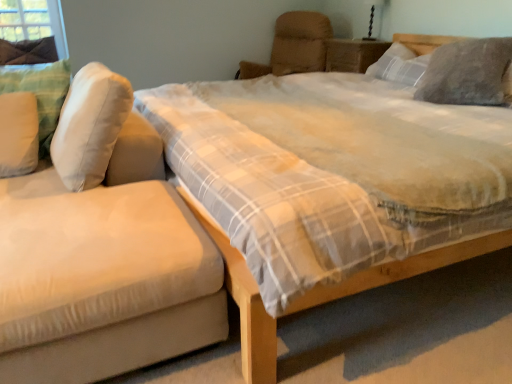
The height and width of the screenshot is (384, 512). Describe the element at coordinates (33, 22) in the screenshot. I see `green fabric at upper left` at that location.

In order to face beige fabric armchair at upper center, should I rotate leftwards or rightwards?

It's best to rotate right around 3.256 degrees.

Image resolution: width=512 pixels, height=384 pixels. What do you see at coordinates (243, 304) in the screenshot? I see `velvet beige bed at center` at bounding box center [243, 304].

Locate an element on the screen. The image size is (512, 384). suede-like beige studio couch at left is located at coordinates (97, 244).

Measure the distance from green fabric at upper left to gray fuzzy pillow at upper right, the 4th pillow from the left.

A distance of 9.87 feet exists between green fabric at upper left and gray fuzzy pillow at upper right, the 4th pillow from the left.

From the image's perspective, is green fabric at upper left located beneath gray fuzzy pillow at upper right, the 1th pillow positioned from the right?

No, from the image's perspective, green fabric at upper left is not below gray fuzzy pillow at upper right, the 1th pillow positioned from the right.

Identify the location of the 2nd pillow in front of the green fabric at upper left, counting from the anchor's position. Image resolution: width=512 pixels, height=384 pixels. (466, 72).

Can you confirm if green fabric at upper left is wider than gray fuzzy pillow at upper right, the 1th pillow positioned from the right?

In fact, green fabric at upper left might be narrower than gray fuzzy pillow at upper right, the 1th pillow positioned from the right.

Considering the positions of objects gray fuzzy pillow at upper right, the 4th pillow from the left, and velvet beige bed at center in the image provided, who is more to the right, gray fuzzy pillow at upper right, the 4th pillow from the left, or velvet beige bed at center?

gray fuzzy pillow at upper right, the 4th pillow from the left, is more to the right.

Can you confirm if gray fuzzy pillow at upper right, the 4th pillow from the left, is smaller than velvet beige bed at center?

Correct, gray fuzzy pillow at upper right, the 4th pillow from the left, occupies less space than velvet beige bed at center.

From the image's perspective, is gray fuzzy pillow at upper right, the 4th pillow from the left, above velvet beige bed at center?

Yes, from the image's perspective, gray fuzzy pillow at upper right, the 4th pillow from the left, is over velvet beige bed at center.

Considering the relative sizes of gray fuzzy pillow at upper right, the 1th pillow positioned from the right, and velvet beige bed at center in the image provided, is gray fuzzy pillow at upper right, the 1th pillow positioned from the right, wider than velvet beige bed at center?

No.

Would you say beige fabric armchair at upper center is inside or outside white soft pillow at left, which is counted as the 4th pillow, starting from the right?

beige fabric armchair at upper center is not inside white soft pillow at left, which is counted as the 4th pillow, starting from the right, it's outside.

In the scene shown: Considering the sizes of objects beige fabric armchair at upper center and white soft pillow at left, positioned as the first pillow in left-to-right order, in the image provided, who is thinner, beige fabric armchair at upper center or white soft pillow at left, positioned as the first pillow in left-to-right order,?

white soft pillow at left, positioned as the first pillow in left-to-right order.

Locate an element on the screen. This screenshot has height=384, width=512. the 4th pillow positioned below the beige fabric armchair at upper center (from a real-world perspective) is located at coordinates (40, 93).

Is beige fabric armchair at upper center to the left of white soft pillow at left, positioned as the first pillow in left-to-right order, from the viewer's perspective?

In fact, beige fabric armchair at upper center is to the right of white soft pillow at left, positioned as the first pillow in left-to-right order.

From the image's perspective, is green fabric at upper left beneath white soft pillow at left, which is counted as the 4th pillow, starting from the right?

No, from the image's perspective, green fabric at upper left is not below white soft pillow at left, which is counted as the 4th pillow, starting from the right.

Could you tell me if green fabric at upper left is facing white soft pillow at left, positioned as the first pillow in left-to-right order?

Yes, green fabric at upper left faces towards white soft pillow at left, positioned as the first pillow in left-to-right order.

Does green fabric at upper left have a smaller size compared to white soft pillow at left, positioned as the first pillow in left-to-right order?

Yes, green fabric at upper left is smaller than white soft pillow at left, positioned as the first pillow in left-to-right order.

Which of these two, suede-like beige studio couch at left or white fabric pillow at left, the second pillow from the left, is smaller?

Smaller between the two is white fabric pillow at left, the second pillow from the left.

From the image's perspective, is suede-like beige studio couch at left below white fabric pillow at left, the second pillow from the left?

Indeed, from the image's perspective, suede-like beige studio couch at left is shown beneath white fabric pillow at left, the second pillow from the left.

Considering the relative positions of suede-like beige studio couch at left and white fabric pillow at left, the third pillow from the right, in the image provided, is suede-like beige studio couch at left to the left or to the right of white fabric pillow at left, the third pillow from the right,?

Clearly, suede-like beige studio couch at left is on the left of white fabric pillow at left, the third pillow from the right, in the image.

Does point (194, 309) appear closer or farther from the camera than point (83, 83)?

Point (194, 309) is positioned closer to the camera compared to point (83, 83).

From the picture: Is white soft pillow at left, which is counted as the 4th pillow, starting from the right, further to camera compared to velvet beige bed at center?

Yes, it is.

From the image's perspective, who appears lower, white soft pillow at left, which is counted as the 4th pillow, starting from the right, or velvet beige bed at center?

velvet beige bed at center.

Is white soft pillow at left, which is counted as the 4th pillow, starting from the right, not near velvet beige bed at center?

Yes.

From their relative heights in the image, would you say green fabric at upper left is taller or shorter than white fabric pillow at left, the second pillow from the left?

green fabric at upper left is taller than white fabric pillow at left, the second pillow from the left.

How many degrees apart are the facing directions of green fabric at upper left and white fabric pillow at left, the third pillow from the right?

They differ by 90 degrees in their facing directions.

Is green fabric at upper left wider or thinner than white fabric pillow at left, the third pillow from the right?

green fabric at upper left is thinner than white fabric pillow at left, the third pillow from the right.

Relative to white fabric pillow at left, the second pillow from the left, is green fabric at upper left in front or behind?

green fabric at upper left is behind white fabric pillow at left, the second pillow from the left.

This screenshot has height=384, width=512. I want to click on the 4th pillow to the right of the green fabric at upper left, starting your count from the anchor, so click(466, 72).

Identify the location of bed on the left of gray fuzzy pillow at upper right, the 1th pillow positioned from the right. The image size is (512, 384). (243, 304).

Considering their positions, is gray velvety pillow at upper right, which appears as the second pillow when viewed from the right, positioned closer to gray fuzzy pillow at upper right, the 4th pillow from the left, than velvet beige bed at center?

gray velvety pillow at upper right, which appears as the second pillow when viewed from the right, is closer to gray fuzzy pillow at upper right, the 4th pillow from the left.

Based on their spatial positions, is suede-like beige studio couch at left or green fabric at upper left closer to beige fabric armchair at upper center?

The object closer to beige fabric armchair at upper center is green fabric at upper left.

Considering their positions, is white fabric pillow at left, the second pillow from the left, positioned further to white soft pillow at left, which is counted as the 4th pillow, starting from the right, than green fabric at upper left?

Among the two, green fabric at upper left is located further to white soft pillow at left, which is counted as the 4th pillow, starting from the right.

From the image, which object appears to be farther from white fabric pillow at left, the third pillow from the right, velvet beige bed at center or green fabric at upper left?

green fabric at upper left is further to white fabric pillow at left, the third pillow from the right.

From the image, which object appears to be farther from gray velvety pillow at upper right, which appears as the second pillow when viewed from the right, gray fuzzy pillow at upper right, the 1th pillow positioned from the right, or white fabric pillow at left, the third pillow from the right?

Among the two, white fabric pillow at left, the third pillow from the right, is located further to gray velvety pillow at upper right, which appears as the second pillow when viewed from the right.

Estimate the real-world distances between objects in this image. Which object is further from suede-like beige studio couch at left, beige fabric armchair at upper center or green fabric at upper left?

beige fabric armchair at upper center.

Estimate the real-world distances between objects in this image. Which object is further from green fabric at upper left, white soft pillow at left, positioned as the first pillow in left-to-right order, or velvet beige bed at center?

velvet beige bed at center is positioned further to the anchor green fabric at upper left.

When comparing their distances from gray velvety pillow at upper right, which appears as the second pillow when viewed from the right, does velvet beige bed at center or black glass table lamp at upper right seem further?

Among the two, velvet beige bed at center is located further to gray velvety pillow at upper right, which appears as the second pillow when viewed from the right.

The width and height of the screenshot is (512, 384). Identify the location of armchair located between white soft pillow at left, which is counted as the 4th pillow, starting from the right, and gray fuzzy pillow at upper right, the 1th pillow positioned from the right, in the left-right direction. (294, 46).

Where is `table lamp between white fabric pillow at left, the third pillow from the right, and gray velvety pillow at upper right, which appears as the second pillow when viewed from the right, from left to right`? The image size is (512, 384). table lamp between white fabric pillow at left, the third pillow from the right, and gray velvety pillow at upper right, which appears as the second pillow when viewed from the right, from left to right is located at coordinates (372, 18).

Where is `bed located between green fabric at upper left and wooden nightstand at upper center in the left-right direction`? bed located between green fabric at upper left and wooden nightstand at upper center in the left-right direction is located at coordinates (243, 304).

Where is `pillow between suede-like beige studio couch at left and white soft pillow at left, positioned as the first pillow in left-to-right order, in the front-back direction`? The image size is (512, 384). pillow between suede-like beige studio couch at left and white soft pillow at left, positioned as the first pillow in left-to-right order, in the front-back direction is located at coordinates (90, 126).